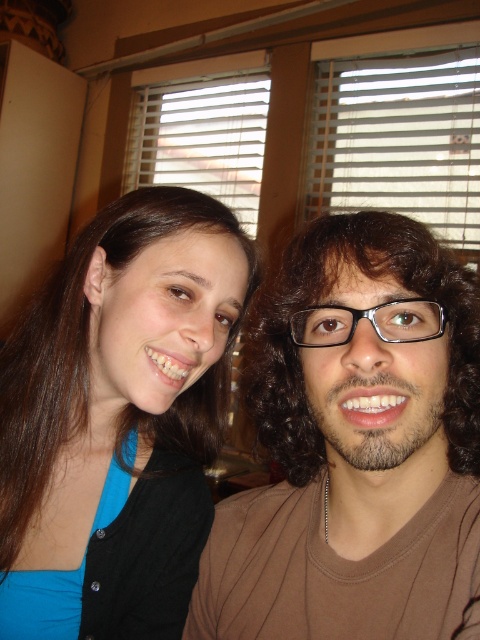
Question: Can you confirm if brown matte shirt at center is wider than blue fabric shirt at upper left?

Choices:
 (A) no
 (B) yes

Answer: (A)

Question: Which point is farther from the camera taking this photo?

Choices:
 (A) (439, 275)
 (B) (109, 616)

Answer: (B)

Question: Is brown matte shirt at center smaller than blue fabric shirt at upper left?

Choices:
 (A) no
 (B) yes

Answer: (B)

Question: Is brown matte shirt at center closer to the viewer compared to blue fabric shirt at upper left?

Choices:
 (A) yes
 (B) no

Answer: (A)